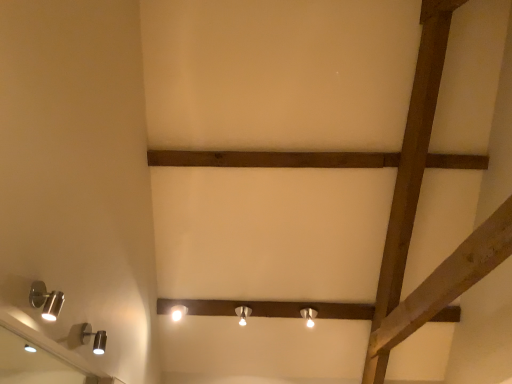
Where is `satin silver spotlight at lower left, the 5th lamp positioned from the back`? satin silver spotlight at lower left, the 5th lamp positioned from the back is located at coordinates (46, 300).

How much space does matte silver lamp at center, marked as the 5th lamp in a front-to-back arrangement, occupy horizontally?

matte silver lamp at center, marked as the 5th lamp in a front-to-back arrangement, is 4.53 inches in width.

Find the location of a particular element. silver metallic mirror at lower left is located at coordinates (34, 364).

Is satin silver spotlight at lower left, the 5th lamp positioned from the back, positioned with its back to matte silver lamp at center, placed as the 5th lamp when sorted from top to bottom?

No.

Considering the relative sizes of satin silver spotlight at lower left, marked as the first lamp in a front-to-back arrangement, and matte silver lamp at center, which is the fifth lamp in left-to-right order, in the image provided, is satin silver spotlight at lower left, marked as the first lamp in a front-to-back arrangement, taller than matte silver lamp at center, which is the fifth lamp in left-to-right order,?

Indeed, satin silver spotlight at lower left, marked as the first lamp in a front-to-back arrangement, has a greater height compared to matte silver lamp at center, which is the fifth lamp in left-to-right order.

From the image's perspective, is satin silver spotlight at lower left, the 5th lamp positioned from the back, located beneath matte silver lamp at center, the 3th lamp positioned from the back?

No, from the image's perspective, satin silver spotlight at lower left, the 5th lamp positioned from the back, is not beneath matte silver lamp at center, the 3th lamp positioned from the back.

In the scene shown: From a real-world perspective, is satin silver spotlight at lower left, positioned as the 1th lamp in top-to-bottom order, below matte silver lamp at center, the 3th lamp when ordered from front to back?

Yes, from a real-world perspective, satin silver spotlight at lower left, positioned as the 1th lamp in top-to-bottom order, is below matte silver lamp at center, the 3th lamp when ordered from front to back.

Between brown wooden plank at center and satin silver spotlight at lower left, the second lamp when ordered from front to back, which one is positioned behind?

brown wooden plank at center is further from the camera.

Can you confirm if brown wooden plank at center is shorter than satin silver spotlight at lower left, the 4th lamp in the back-to-front sequence?

Indeed, brown wooden plank at center has a lesser height compared to satin silver spotlight at lower left, the 4th lamp in the back-to-front sequence.

How many degrees apart are the facing directions of brown wooden plank at center and satin silver spotlight at lower left, the second lamp when ordered from front to back?

The facing directions of brown wooden plank at center and satin silver spotlight at lower left, the second lamp when ordered from front to back, are 90.2 degrees apart.

In terms of width, does brown wooden plank at center look wider or thinner when compared to satin silver spotlight at lower left, the second lamp when ordered from front to back?

In the image, brown wooden plank at center appears to be more narrow than satin silver spotlight at lower left, the second lamp when ordered from front to back.

Is matte silver lamp at center, which is the first lamp from right to left, shorter than matte silver lamp at center, marked as the 5th lamp in a front-to-back arrangement?

Yes, matte silver lamp at center, which is the first lamp from right to left, is shorter than matte silver lamp at center, marked as the 5th lamp in a front-to-back arrangement.

From the picture: Is the position of matte silver lamp at center, which is the first lamp from right to left, less distant than that of matte silver lamp at center, marked as the 5th lamp in a front-to-back arrangement?

Yes.

Could you tell me if matte silver lamp at center, which is the fifth lamp in left-to-right order, is turned towards matte silver lamp at center, the 1th lamp viewed from the back?

No, matte silver lamp at center, which is the fifth lamp in left-to-right order, does not turn towards matte silver lamp at center, the 1th lamp viewed from the back.

Is white glossy lamp at center, the third lamp when ordered from top to bottom, oriented towards satin silver spotlight at lower left, the 4th lamp in the back-to-front sequence?

Yes, white glossy lamp at center, the third lamp when ordered from top to bottom, faces towards satin silver spotlight at lower left, the 4th lamp in the back-to-front sequence.

From the picture: From a real-world perspective, is white glossy lamp at center, which appears as the third lamp when ordered from the bottom, physically located above or below satin silver spotlight at lower left, the second lamp from the left?

Clearly, from a real-world perspective, white glossy lamp at center, which appears as the third lamp when ordered from the bottom, is above satin silver spotlight at lower left, the second lamp from the left.

Between white glossy lamp at center, the second lamp positioned from the back, and satin silver spotlight at lower left, the second lamp when ordered from front to back, which one has more height?

Standing taller between the two is satin silver spotlight at lower left, the second lamp when ordered from front to back.

Considering the sizes of white glossy lamp at center, positioned as the third lamp in right-to-left order, and satin silver spotlight at lower left, the second lamp when ordered from front to back, in the image, is white glossy lamp at center, positioned as the third lamp in right-to-left order, bigger or smaller than satin silver spotlight at lower left, the second lamp when ordered from front to back,?

white glossy lamp at center, positioned as the third lamp in right-to-left order, is bigger than satin silver spotlight at lower left, the second lamp when ordered from front to back.

Would you consider satin silver spotlight at lower left, the second lamp from the left, to be distant from silver metallic mirror at lower left?

Yes, satin silver spotlight at lower left, the second lamp from the left, is far from silver metallic mirror at lower left.

From the picture: From a real-world perspective, which is physically below, satin silver spotlight at lower left, marked as the 2th lamp in a top-to-bottom arrangement, or silver metallic mirror at lower left?

From a 3D spatial view, silver metallic mirror at lower left is below.

Looking at this image, from the image's perspective, is satin silver spotlight at lower left, arranged as the fourth lamp when ordered from the bottom, located above silver metallic mirror at lower left?

Yes, from the image's perspective, satin silver spotlight at lower left, arranged as the fourth lamp when ordered from the bottom, is above silver metallic mirror at lower left.

Can you confirm if satin silver spotlight at lower left, the second lamp from the left, is positioned to the left of silver metallic mirror at lower left?

In fact, satin silver spotlight at lower left, the second lamp from the left, is to the right of silver metallic mirror at lower left.

Who is bigger, satin silver spotlight at lower left, the fifth lamp in the right-to-left sequence, or silver metallic mirror at lower left?

Bigger between the two is silver metallic mirror at lower left.

Is satin silver spotlight at lower left, the fifth lamp in the right-to-left sequence, positioned far away from silver metallic mirror at lower left?

satin silver spotlight at lower left, the fifth lamp in the right-to-left sequence, is positioned a significant distance from silver metallic mirror at lower left.

Could you tell me if satin silver spotlight at lower left, marked as the first lamp in a front-to-back arrangement, is facing silver metallic mirror at lower left?

No, satin silver spotlight at lower left, marked as the first lamp in a front-to-back arrangement, is not facing towards silver metallic mirror at lower left.

Relative to silver metallic mirror at lower left, is satin silver spotlight at lower left, marked as the first lamp in a front-to-back arrangement, in front or behind?

satin silver spotlight at lower left, marked as the first lamp in a front-to-back arrangement, is positioned farther from the viewer than silver metallic mirror at lower left.

Considering the positions of objects brown wooden plank at center and matte silver lamp at center, the 3th lamp when ordered from front to back, in the image provided, who is more to the left, brown wooden plank at center or matte silver lamp at center, the 3th lamp when ordered from front to back,?

Positioned to the left is matte silver lamp at center, the 3th lamp when ordered from front to back.

Between point (437, 156) and point (310, 326), which one is positioned behind?

Point (310, 326)

Can matte silver lamp at center, which is the first lamp from right to left, be found inside brown wooden plank at center?

No, matte silver lamp at center, which is the first lamp from right to left, is not inside brown wooden plank at center.

Considering the sizes of brown wooden plank at center and matte silver lamp at center, placed as the 5th lamp when sorted from top to bottom, in the image, is brown wooden plank at center taller or shorter than matte silver lamp at center, placed as the 5th lamp when sorted from top to bottom,?

In the image, brown wooden plank at center appears to be shorter than matte silver lamp at center, placed as the 5th lamp when sorted from top to bottom.

Image resolution: width=512 pixels, height=384 pixels. What are the coordinates of `the 2nd lamp positioned above the satin silver spotlight at lower left, the fifth lamp in the right-to-left sequence (from a real-world perspective)` in the screenshot? It's located at (309, 316).

This screenshot has height=384, width=512. Identify the location of plank behind the satin silver spotlight at lower left, marked as the 2th lamp in a top-to-bottom arrangement. (272, 159).

Which object lies further to the anchor point brown wooden plank at center, silver metallic mirror at lower left or matte silver lamp at center, which is the second lamp in right-to-left order?

silver metallic mirror at lower left is positioned further to the anchor brown wooden plank at center.

Which object lies further to the anchor point satin silver spotlight at lower left, marked as the first lamp in a front-to-back arrangement, matte silver lamp at center, the 3th lamp positioned from the back, or satin silver spotlight at lower left, the second lamp when ordered from front to back?

matte silver lamp at center, the 3th lamp positioned from the back, is further to satin silver spotlight at lower left, marked as the first lamp in a front-to-back arrangement.

From the image, which object appears to be farther from matte silver lamp at center, marked as the 5th lamp in a front-to-back arrangement, silver metallic mirror at lower left or satin silver spotlight at lower left, positioned as the 1th lamp in top-to-bottom order?

satin silver spotlight at lower left, positioned as the 1th lamp in top-to-bottom order, lies further to matte silver lamp at center, marked as the 5th lamp in a front-to-back arrangement, than the other object.

Based on their spatial positions, is white glossy lamp at center, the second lamp positioned from the back, or matte silver lamp at center, the 3th lamp positioned from the back, closer to satin silver spotlight at lower left, arranged as the fourth lamp when ordered from the bottom?

Based on the image, white glossy lamp at center, the second lamp positioned from the back, appears to be nearer to satin silver spotlight at lower left, arranged as the fourth lamp when ordered from the bottom.

Which object lies further to the anchor point matte silver lamp at center, which is counted as the first lamp, starting from the bottom, satin silver spotlight at lower left, positioned as the 1th lamp in top-to-bottom order, or white glossy lamp at center, the second lamp positioned from the back?

satin silver spotlight at lower left, positioned as the 1th lamp in top-to-bottom order, is positioned further to the anchor matte silver lamp at center, which is counted as the first lamp, starting from the bottom.

Considering their positions, is silver metallic mirror at lower left positioned closer to satin silver spotlight at lower left, the second lamp from the left, than matte silver lamp at center, placed as the 5th lamp when sorted from top to bottom?

silver metallic mirror at lower left is closer to satin silver spotlight at lower left, the second lamp from the left.

Considering their positions, is satin silver spotlight at lower left, the second lamp from the left, positioned closer to silver metallic mirror at lower left than brown wooden plank at center?

The object closer to silver metallic mirror at lower left is satin silver spotlight at lower left, the second lamp from the left.

Based on their spatial positions, is white glossy lamp at center, which appears as the third lamp when ordered from the bottom, or silver metallic mirror at lower left further from satin silver spotlight at lower left, the 4th lamp in the back-to-front sequence?

Based on the image, silver metallic mirror at lower left appears to be further to satin silver spotlight at lower left, the 4th lamp in the back-to-front sequence.

The width and height of the screenshot is (512, 384). In order to click on lamp between satin silver spotlight at lower left, marked as the first lamp in a front-to-back arrangement, and brown wooden plank at center, along the z-axis in this screenshot , I will do `click(94, 338)`.

I want to click on plank between silver metallic mirror at lower left and matte silver lamp at center, which is the fifth lamp in left-to-right order, from front to back, so [272, 159].

Where is `lamp between satin silver spotlight at lower left, the second lamp when ordered from front to back, and white glossy lamp at center, which is the 3th lamp in left-to-right order, from front to back`? This screenshot has width=512, height=384. lamp between satin silver spotlight at lower left, the second lamp when ordered from front to back, and white glossy lamp at center, which is the 3th lamp in left-to-right order, from front to back is located at coordinates (309, 316).

I want to click on plank between satin silver spotlight at lower left, the fourth lamp when ordered from right to left, and white glossy lamp at center, which is the 3th lamp in left-to-right order, along the z-axis, so click(272, 159).